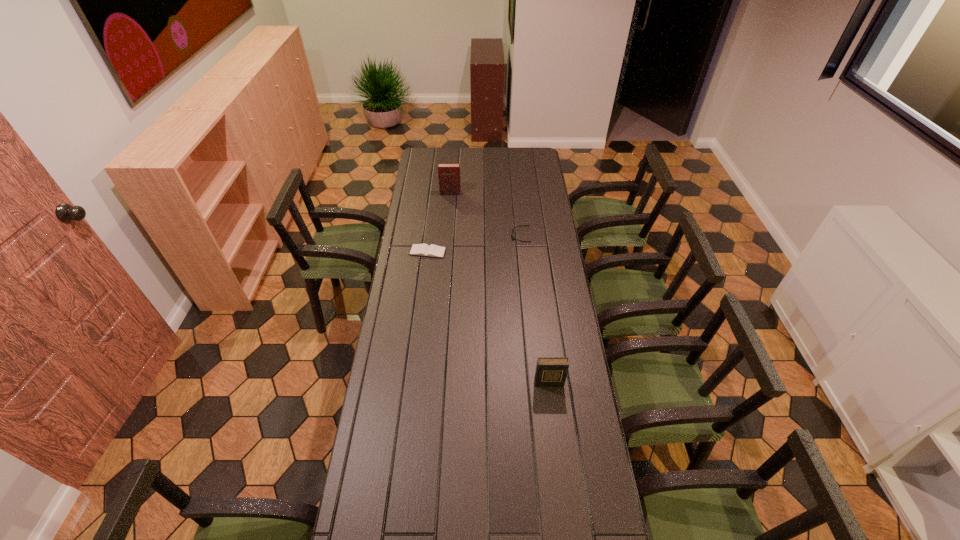
Identify the location of free space located on the front-facing side of the third nearest object. The image size is (960, 540). (448, 236).

At what (x,y) coordinates should I click in order to perform the action: click on vacant space positioned on the front-facing side of the third nearest object. Please return your answer as a coordinate pair (x, y). Looking at the image, I should click on (430, 236).

At what (x,y) coordinates should I click in order to perform the action: click on vacant space located on the front of the second nearest object. Please return your answer as a coordinate pair (x, y). This screenshot has width=960, height=540. Looking at the image, I should click on (422, 294).

At what (x,y) coordinates should I click in order to perform the action: click on diary at the right edge. Please return your answer as a coordinate pair (x, y). The width and height of the screenshot is (960, 540). Looking at the image, I should click on (550, 371).

I want to click on sunglasses present at the right edge, so click(513, 238).

Where is `free region at the far edge of the desktop`? free region at the far edge of the desktop is located at coordinates (493, 158).

Locate an element on the screen. Image resolution: width=960 pixels, height=540 pixels. vacant space at the left edge is located at coordinates tap(409, 477).

The height and width of the screenshot is (540, 960). Identify the location of blank space at the right edge of the desktop. (537, 216).

Where is `free space at the far left corner of the desktop`? This screenshot has height=540, width=960. free space at the far left corner of the desktop is located at coordinates (444, 153).

The height and width of the screenshot is (540, 960). What are the coordinates of `vacant area at the far right corner of the desktop` in the screenshot? It's located at (519, 166).